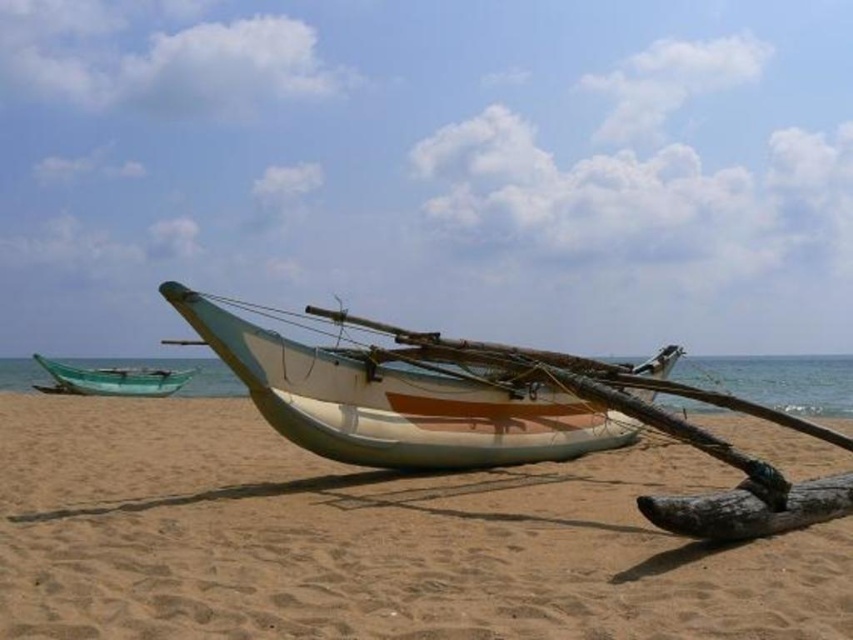
You are standing at the edge of the beach and want to place a 30 feet long object between the sandy brown sand at center and the green plastic boat at left. Is there enough space?

The distance between the sandy brown sand at center and the green plastic boat at left is 60.09 feet, so yes, the 30 feet long object can be placed between them as there is sufficient space.

In the scene shown: You are a sailor who needs to choose between the white matte boat at center and the brown wood log at lower right to carry a heavy crate. Which object can support the crate better based on their widths?

The brown wood log at lower right is wider than the white matte boat at center, so it can support the crate better.

You are standing on the beach and see the sandy brown sand at center and the white matte boat at center. Which object is positioned to the right of the other?

The sandy brown sand at center is to the right of the white matte boat at center, so the sand is positioned to the right of the boat.